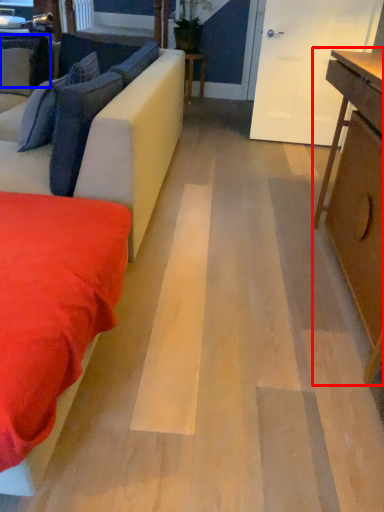
Question: Which object appears closest to the camera in this image, table (highlighted by a red box) or pillow (highlighted by a blue box)?

Choices:
 (A) table
 (B) pillow

Answer: (A)